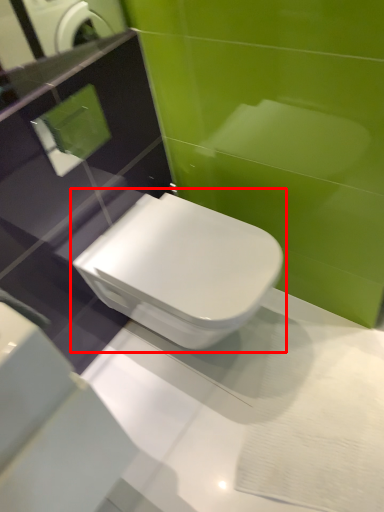
Question: From the image's perspective, where is toilet (annotated by the red box) located relative to mirror?

Choices:
 (A) below
 (B) above

Answer: (A)